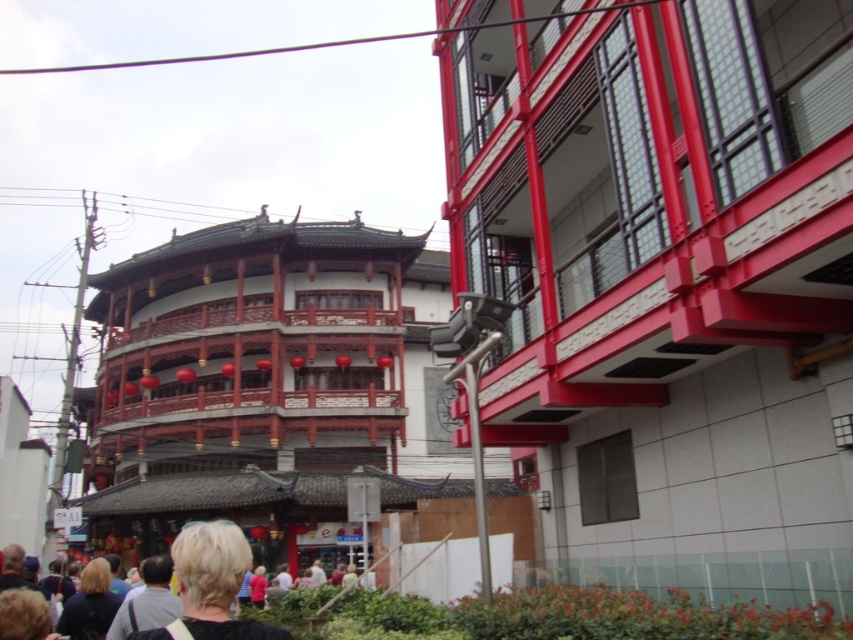
Question: Which point is closer to the camera taking this photo?

Choices:
 (A) (218, 625)
 (B) (762, 132)

Answer: (A)

Question: Is smooth red building at center positioned in front of blonde hair at lower left?

Choices:
 (A) no
 (B) yes

Answer: (A)

Question: Which point appears closest to the camera in this image?

Choices:
 (A) (599, 42)
 (B) (202, 528)

Answer: (B)

Question: Is smooth red building at center below blonde hair at lower left?

Choices:
 (A) yes
 (B) no

Answer: (B)

Question: Considering the relative positions of smooth red building at center and blonde hair at lower left in the image provided, where is smooth red building at center located with respect to blonde hair at lower left?

Choices:
 (A) left
 (B) right

Answer: (B)